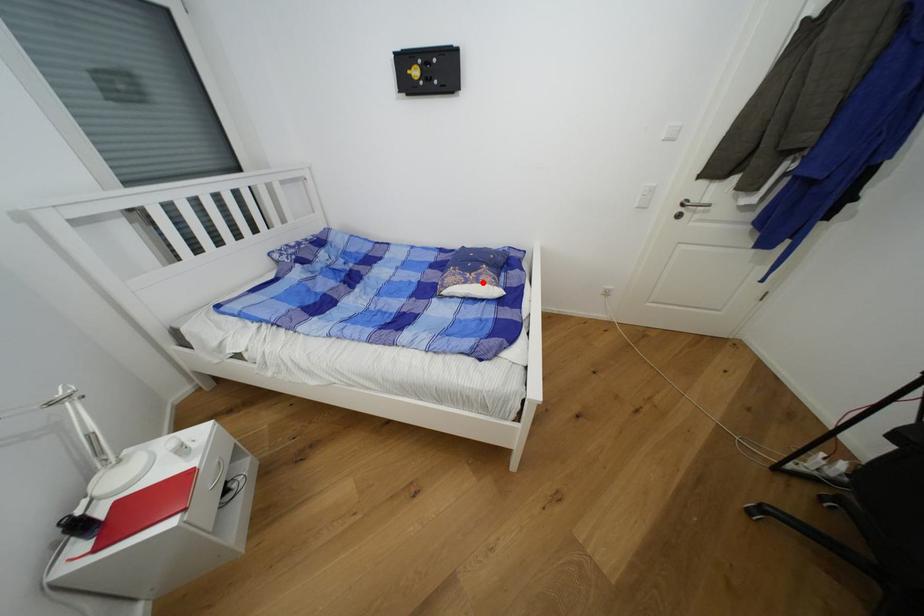
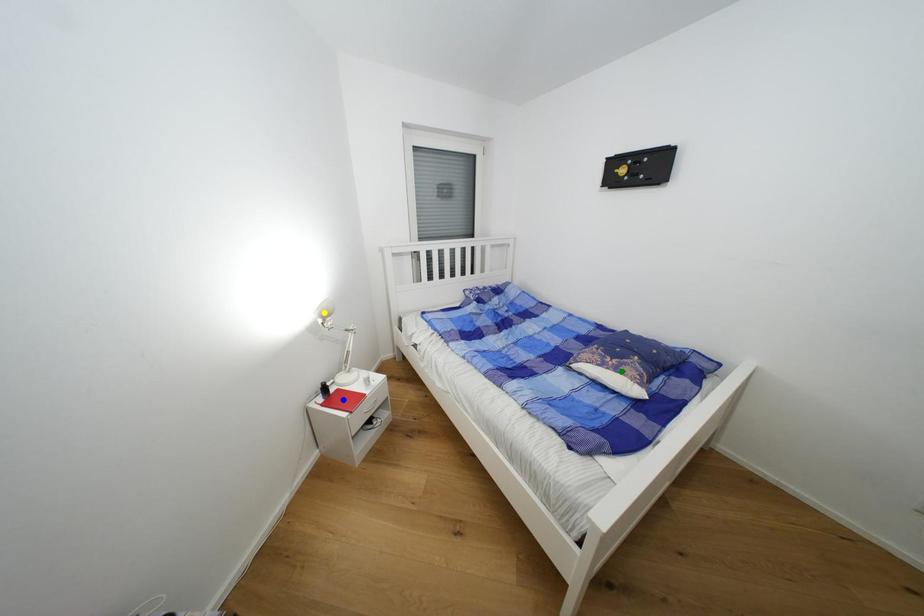
Question: I am providing you with two images of the same scene from different viewpoints. A red point is marked on the first image. You are given multiple points on the second image. In image 2, which mark is for the same physical point as the one in image 1?

Choices:
 (A) yellow point
 (B) green point
 (C) blue point

Answer: (B)